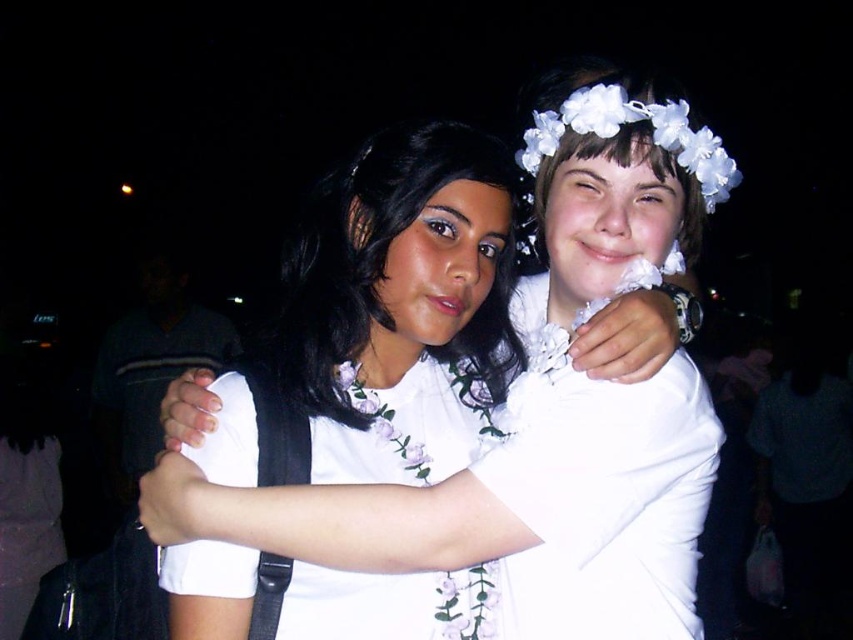
Between white matte floral crown at upper center and white floral crown at upper right, which one has more height?

With more height is white matte floral crown at upper center.

Is point (550, 461) less distant than point (660, 147)?

Yes, point (550, 461) is in front of point (660, 147).

Which is in front, point (241, 541) or point (662, 104)?

Positioned in front is point (241, 541).

Identify the location of white matte floral crown at upper center. click(541, 413).

What do you see at coordinates (541, 413) in the screenshot?
I see `white matte floral crown at upper center` at bounding box center [541, 413].

Which is above, white matte floral crown at upper center or white matte flower crown at upper center?

Positioned higher is white matte flower crown at upper center.

The height and width of the screenshot is (640, 853). What do you see at coordinates (541, 413) in the screenshot? I see `white matte floral crown at upper center` at bounding box center [541, 413].

Identify the location of white matte floral crown at upper center. (541, 413).

Is white matte flower crown at upper center above white floral crown at upper right?

Actually, white matte flower crown at upper center is below white floral crown at upper right.

Is white matte flower crown at upper center thinner than white floral crown at upper right?

Incorrect, white matte flower crown at upper center's width is not less than white floral crown at upper right's.

Is point (407, 346) positioned in front of point (635, 102)?

No, it is behind (635, 102).

I want to click on white matte flower crown at upper center, so click(x=399, y=269).